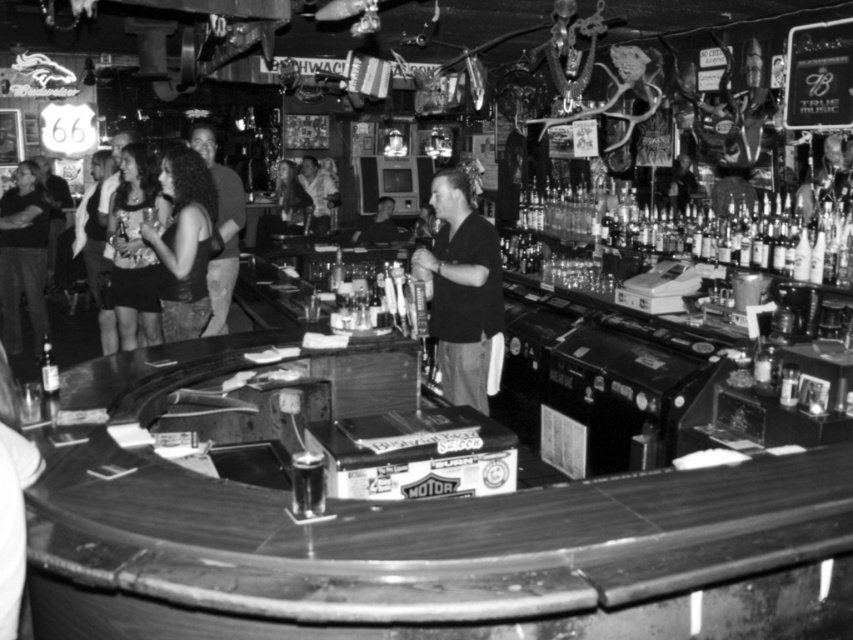
You are a bartender at the bar and need to place a new drink order between the dark brown leather jacket at center and the smooth leather jacket at center. Which direction should you place the drink to ensure it is between them?

The dark brown leather jacket at center is to the right of the smooth leather jacket at center. Therefore, placing the drink to the left of the dark brown leather jacket at center and to the right of the smooth leather jacket at center would position it between them.

Consider the image. You are a photographer trying to capture both the dark fabric shirt at center and the matte black dress at left in a single frame. Since you want to ensure both are visible, which object should you focus on first to maintain clarity, considering their sizes?

The dark fabric shirt at center has a smaller size compared to matte black dress at left. Therefore, you should focus on the dark fabric shirt at center first to ensure its details remain clear, as smaller objects require more precise focus to maintain clarity in photographs.

You are a fashion designer observing the bar scene and notice the matte black dress at left and the smooth leather jacket at center. Which piece of clothing is closer to you?

The matte black dress at left is closer to you since it is further to the viewer than the smooth leather jacket at center.